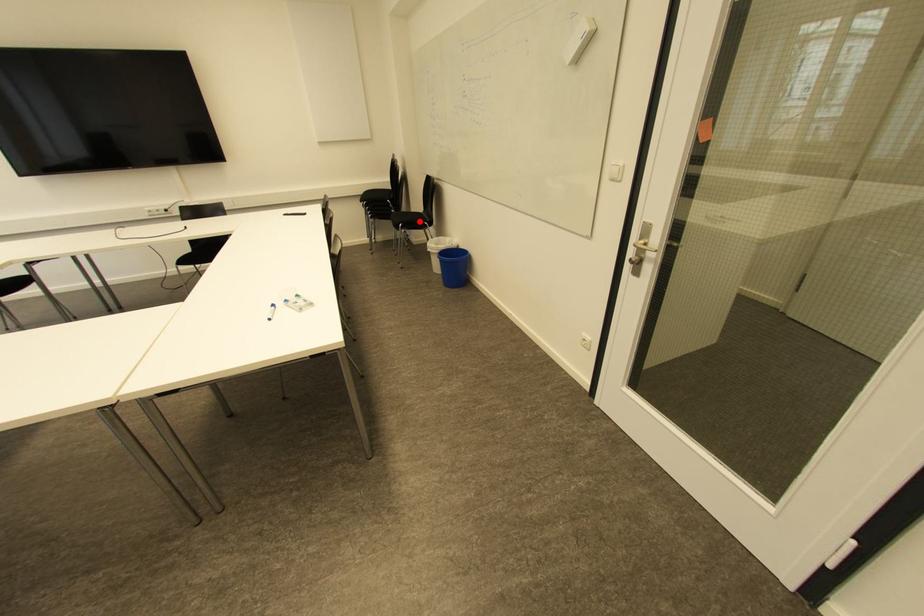
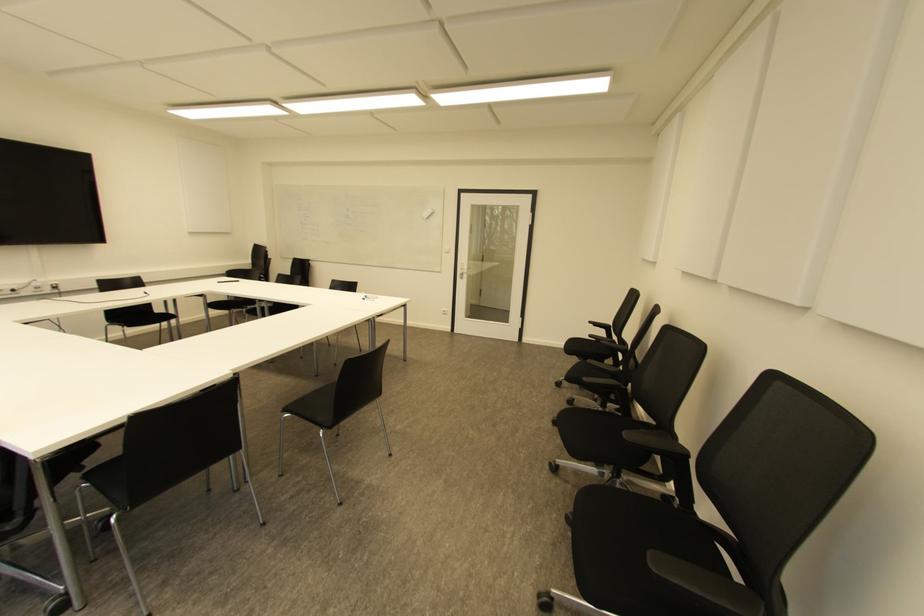
Question: I am providing you with two images of the same scene from different viewpoints. A red point is marked on the first image. Can you still see the location of the red point in image 2?

Choices:
 (A) Yes
 (B) No

Answer: (B)